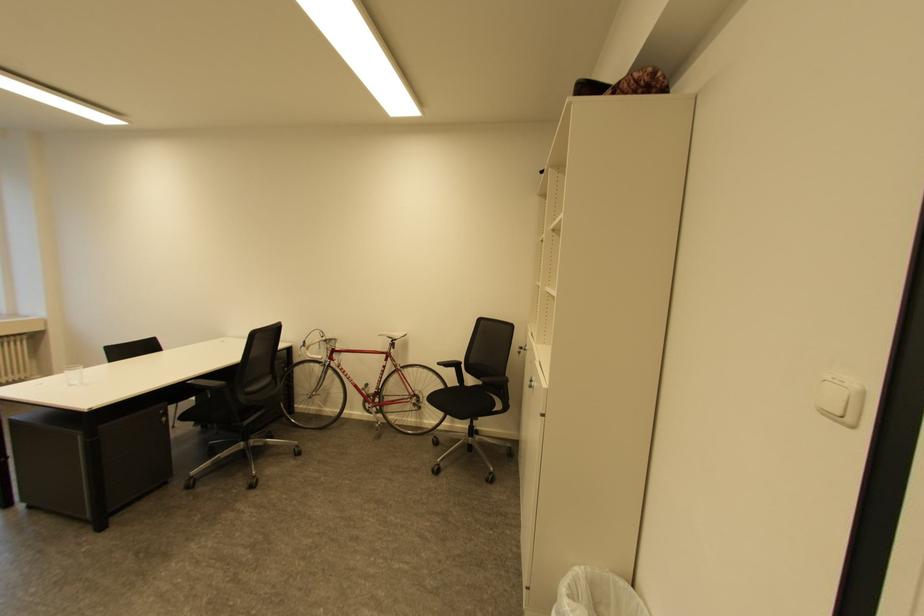
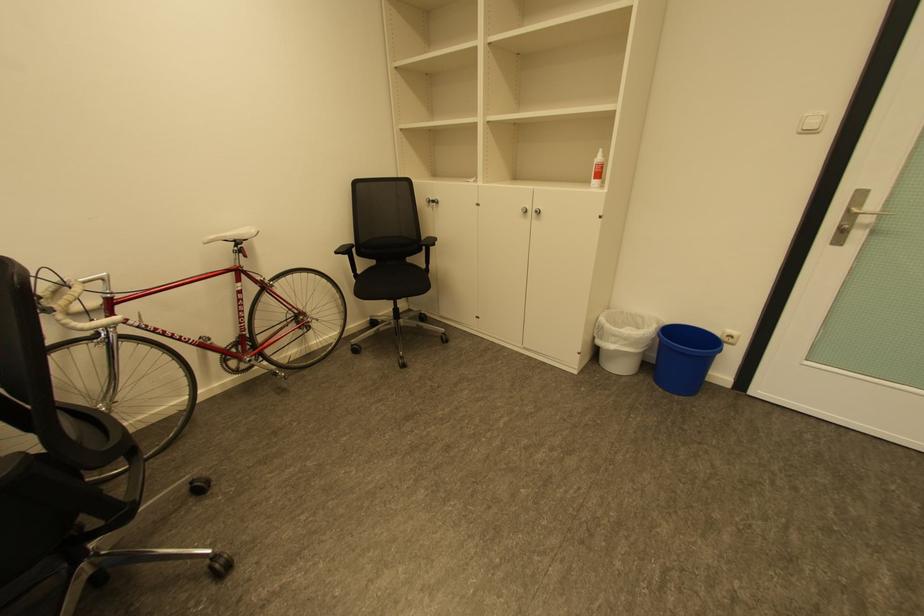
Find the pixel in the second image that matches (x=398, y=339) in the first image.

(241, 241)